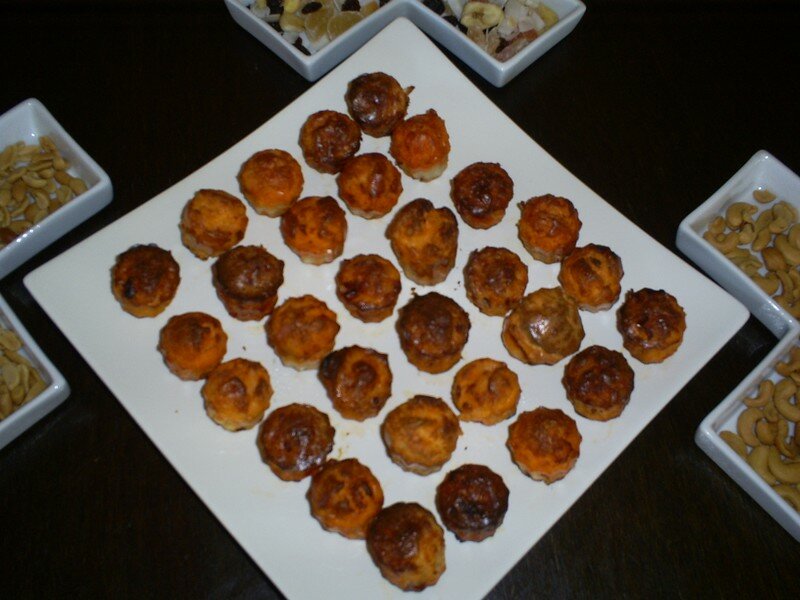
This screenshot has height=600, width=800. Find the location of `bowl of nuts on left`. bowl of nuts on left is located at coordinates (6, 268).